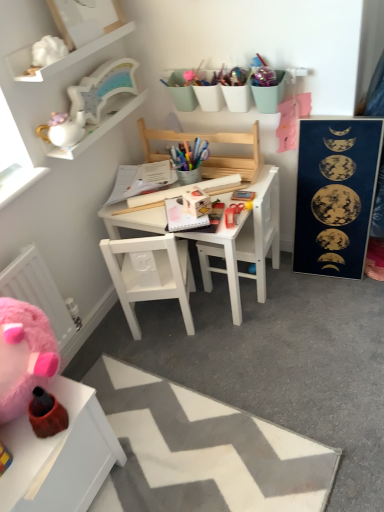
This screenshot has width=384, height=512. I want to click on matte white table at lower left, marked as the second table in a top-to-bottom arrangement, so click(60, 456).

From a real-world perspective, which is physically below, white matte chair at center, placed as the first chair when sorted from bottom to top, or white fluffy cloud at upper left, marked as the 1th toy in a top-to-bottom arrangement?

white matte chair at center, placed as the first chair when sorted from bottom to top, from a real-world perspective.

In the scene shown: Which is more to the right, white matte chair at center, acting as the 2th chair starting from the top, or white fluffy cloud at upper left, which is the 2th toy from bottom to top?

Positioned to the right is white matte chair at center, acting as the 2th chair starting from the top.

From the image's perspective, is white matte chair at center, placed as the first chair when sorted from bottom to top, above white fluffy cloud at upper left, which is the 2th toy from bottom to top?

No, from the image's perspective, white matte chair at center, placed as the first chair when sorted from bottom to top, is not over white fluffy cloud at upper left, which is the 2th toy from bottom to top.

Between white matte chair at center, acting as the 2th chair starting from the top, and white fluffy cloud at upper left, which is the 2th toy from bottom to top, which one has less height?

white fluffy cloud at upper left, which is the 2th toy from bottom to top.

Can you confirm if wooden chair at center, acting as the first chair starting from the top, is taller than white wooden table at center, which is the first table from top to bottom?

No, wooden chair at center, acting as the first chair starting from the top, is not taller than white wooden table at center, which is the first table from top to bottom.

From a real-world perspective, is wooden chair at center, which appears as the 2th chair when ordered from the bottom, physically above white wooden table at center, arranged as the 2th table when viewed from the front?

Yes, from a real-world perspective, wooden chair at center, which appears as the 2th chair when ordered from the bottom, is over white wooden table at center, arranged as the 2th table when viewed from the front

From the image's perspective, is wooden chair at center, acting as the first chair starting from the top, on top of white wooden table at center, arranged as the second table when ordered from the bottom?

Correct, wooden chair at center, acting as the first chair starting from the top, appears higher than white wooden table at center, arranged as the second table when ordered from the bottom, in the image.

From a real-world perspective, is white zigzag rug at lower center positioned over white fluffy cloud at upper left, marked as the 1th toy in a top-to-bottom arrangement, based on gravity?

No, from a real-world perspective, white zigzag rug at lower center is not on top of white fluffy cloud at upper left, marked as the 1th toy in a top-to-bottom arrangement.

Considering the positions of points (265, 437) and (42, 51), is point (265, 437) closer to camera compared to point (42, 51)?

No, it is not.

Considering the relative sizes of white zigzag rug at lower center and white fluffy cloud at upper left, marked as the 1th toy in a top-to-bottom arrangement, in the image provided, is white zigzag rug at lower center taller than white fluffy cloud at upper left, marked as the 1th toy in a top-to-bottom arrangement,?

No.

Can you confirm if white glossy mug at upper left is taller than white matte cloud at upper left?

Correct, white glossy mug at upper left is much taller as white matte cloud at upper left.

Is point (85, 147) closer or farther from the camera than point (17, 77)?

Point (85, 147).

Can you confirm if white glossy mug at upper left is bigger than white matte cloud at upper left?

Yes, white glossy mug at upper left is bigger than white matte cloud at upper left.

From the image's perspective, is blue matte poster at right below white wooden table at center, which is counted as the 1th table, starting from the back?

Incorrect, from the image's perspective, blue matte poster at right is higher than white wooden table at center, which is counted as the 1th table, starting from the back.

Is blue matte poster at right positioned with its back to white wooden table at center, which is counted as the 1th table, starting from the back?

No.

Is blue matte poster at right not near white wooden table at center, arranged as the second table when ordered from the bottom?

blue matte poster at right is actually quite close to white wooden table at center, arranged as the second table when ordered from the bottom.

Is blue matte poster at right taller or shorter than white wooden table at center, which is the first table from top to bottom?

blue matte poster at right is taller than white wooden table at center, which is the first table from top to bottom.

Is white zigzag rug at lower center directly adjacent to wooden chair at center, acting as the first chair starting from the top?

They are not placed beside each other.

Does white zigzag rug at lower center turn towards wooden chair at center, acting as the first chair starting from the top?

No, white zigzag rug at lower center is not facing towards wooden chair at center, acting as the first chair starting from the top.

Is point (181, 401) positioned behind point (234, 140)?

That is False.

Can you confirm if white zigzag rug at lower center is positioned to the right of wooden chair at center, which appears as the 2th chair when ordered from the bottom?

No.

Is white glossy mug at upper left looking in the opposite direction of matte white table at lower left, the 2th table when ordered from back to front?

That's not correct — white glossy mug at upper left is not looking away from matte white table at lower left, the 2th table when ordered from back to front.

From the image's perspective, relative to matte white table at lower left, the 2th table when ordered from back to front, is white glossy mug at upper left above or below?

Based on their image positions, white glossy mug at upper left is located above matte white table at lower left, the 2th table when ordered from back to front.

Is matte white table at lower left, marked as the second table in a top-to-bottom arrangement, completely or partially inside white glossy mug at upper left?

Definitely not — matte white table at lower left, marked as the second table in a top-to-bottom arrangement, is not inside white glossy mug at upper left.

Find the location of a particular element. The width and height of the screenshot is (384, 512). chair that is the 1st object to the right of the white fluffy cloud at upper left, marked as the 1th toy in a top-to-bottom arrangement, starting at the anchor is located at coordinates (153, 271).

Find the location of a particular element. This screenshot has height=512, width=384. the 1st table below the wooden chair at center, acting as the first chair starting from the top (from the image's perspective) is located at coordinates (245, 241).

When comparing their distances from matte white table at lower left, placed as the 1th table when sorted from bottom to top, does white matte cloud at upper left or wooden chair at center, which appears as the 2th chair when ordered from the bottom, seem closer?

Among the two, wooden chair at center, which appears as the 2th chair when ordered from the bottom, is located nearer to matte white table at lower left, placed as the 1th table when sorted from bottom to top.

Considering their positions, is white zigzag rug at lower center positioned closer to white glossy mug at upper left than white fluffy cloud at upper left, marked as the 1th toy in a top-to-bottom arrangement?

Based on the image, white fluffy cloud at upper left, marked as the 1th toy in a top-to-bottom arrangement, appears to be nearer to white glossy mug at upper left.

Considering their positions, is white fluffy cloud at upper left, which is the 2th toy from bottom to top, positioned closer to white matte cloud at upper left than white wooden changing table at center?

The object closer to white matte cloud at upper left is white fluffy cloud at upper left, which is the 2th toy from bottom to top.

Looking at the image, which one is located closer to white wooden changing table at center, wooden chair at center, acting as the first chair starting from the top, or white matte chair at center, placed as the first chair when sorted from bottom to top?

Among the two, wooden chair at center, acting as the first chair starting from the top, is located nearer to white wooden changing table at center.

Looking at this image, from the image, which object appears to be farther from matte white table at lower left, positioned as the first table in front-to-back order, wooden chair at center, which appears as the 2th chair when ordered from the bottom, or white glossy mug at upper left?

wooden chair at center, which appears as the 2th chair when ordered from the bottom, is further to matte white table at lower left, positioned as the first table in front-to-back order.

Considering their positions, is matte white table at lower left, the 2th table when ordered from back to front, positioned further to white fluffy cloud at upper left, marked as the 1th toy in a top-to-bottom arrangement, than white matte cloud at upper left?

The object further to white fluffy cloud at upper left, marked as the 1th toy in a top-to-bottom arrangement, is matte white table at lower left, the 2th table when ordered from back to front.

From the image, which object appears to be farther from white zigzag rug at lower center, white wooden table at center, arranged as the 2th table when viewed from the front, or white glossy mug at upper left?

white glossy mug at upper left.

Looking at the image, which one is located closer to white ceramic teapot at upper left, the second toy when ordered from top to bottom, white fluffy cloud at upper left, which is the 2th toy from bottom to top, or white wooden table at center, arranged as the second table when ordered from the bottom?

white fluffy cloud at upper left, which is the 2th toy from bottom to top, is closer to white ceramic teapot at upper left, the second toy when ordered from top to bottom.

Locate an element on the screen. The height and width of the screenshot is (512, 384). changing table that lies between wooden chair at center, which appears as the 2th chair when ordered from the bottom, and white wooden table at center, arranged as the 2th table when viewed from the front, from top to bottom is located at coordinates (248, 239).

Where is `changing table between white fluffy cloud at upper left, which is the 2th toy from bottom to top, and white matte chair at center, placed as the first chair when sorted from bottom to top, vertically`? Image resolution: width=384 pixels, height=512 pixels. changing table between white fluffy cloud at upper left, which is the 2th toy from bottom to top, and white matte chair at center, placed as the first chair when sorted from bottom to top, vertically is located at coordinates (248, 239).

The height and width of the screenshot is (512, 384). I want to click on toy between white glossy mug at upper left and white matte chair at center, placed as the first chair when sorted from bottom to top, in the vertical direction, so (66, 123).

Identify the location of chair that lies between white wooden table at center, which is the first table from top to bottom, and matte white table at lower left, positioned as the first table in front-to-back order, from top to bottom. (153, 271).